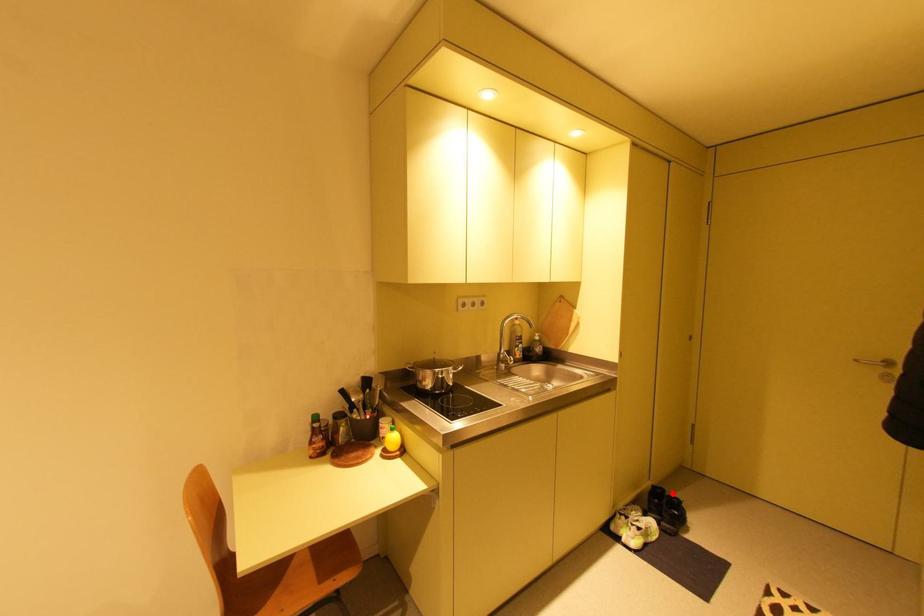
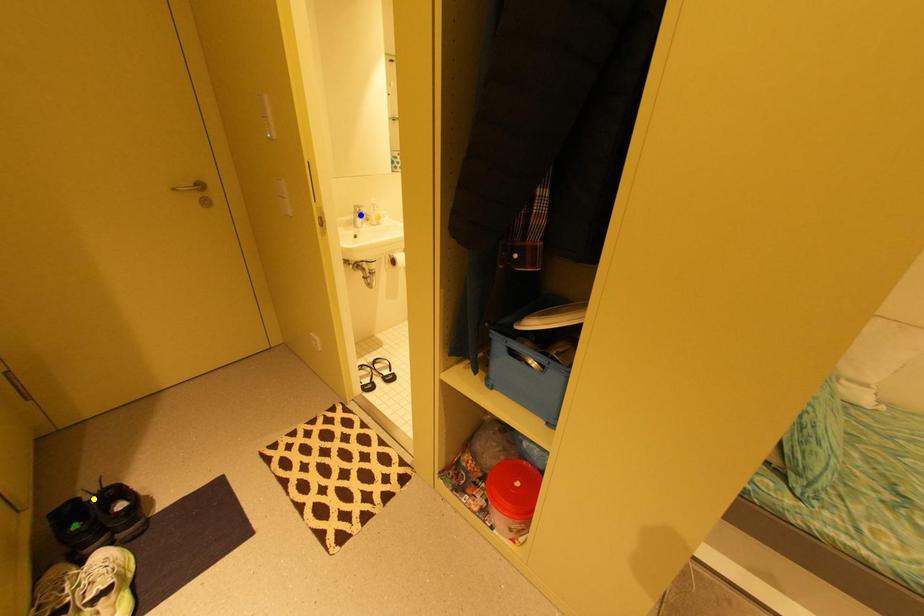
Question: I am providing you with two images of the same scene from different viewpoints. A red point is marked on the first image. You are given multiple points on the second image. Which mark in image 2 goes with the point in image 1?

Choices:
 (A) yellow point
 (B) green point
 (C) blue point

Answer: (A)